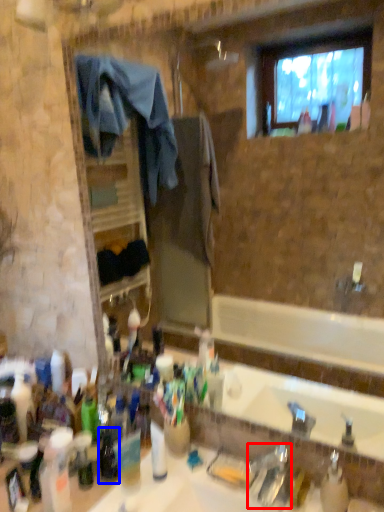
Question: Which of the following is the farthest to the observer, faucet (highlighted by a red box) or bottle (highlighted by a blue box)?

Choices:
 (A) faucet
 (B) bottle

Answer: (B)